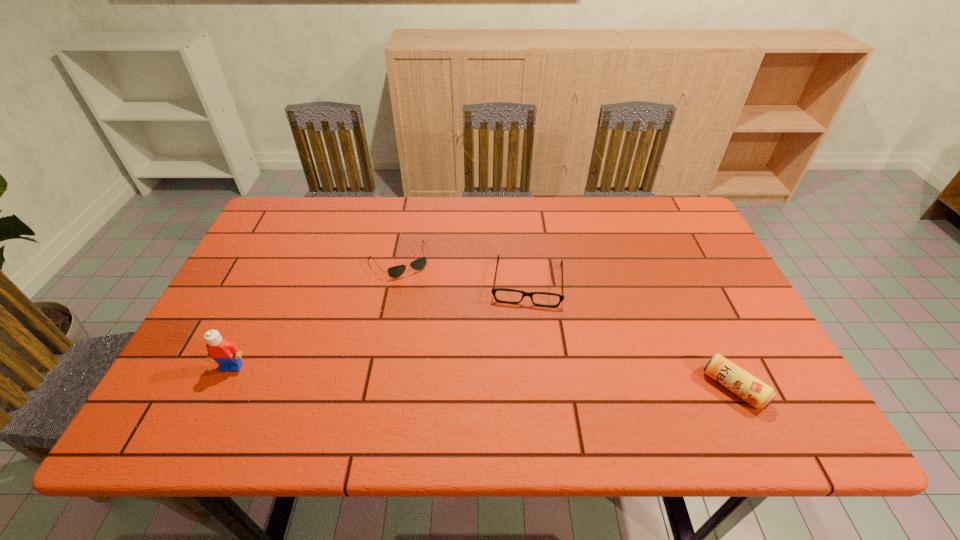
Locate an element on the screen. Image resolution: width=960 pixels, height=540 pixels. the tallest object is located at coordinates (226, 354).

Locate an element on the screen. Image resolution: width=960 pixels, height=540 pixels. Lego is located at coordinates (226, 354).

Where is `the rightmost object`? This screenshot has width=960, height=540. the rightmost object is located at coordinates (746, 386).

Identify the location of the third object from right to left. (396, 271).

The width and height of the screenshot is (960, 540). Identify the location of the third object from left to right. (524, 293).

Locate an element on the screen. The image size is (960, 540). free space located on the left of the rightmost object is located at coordinates (669, 388).

The width and height of the screenshot is (960, 540). Identify the location of free space located 0.330m on the lenses of the second object from left to right. (464, 370).

At what (x,y) coordinates should I click in order to perform the action: click on blank area located on the lenses of the second object from left to right. Please return your answer as a coordinate pair (x, y). Looking at the image, I should click on (451, 348).

In order to click on free space located 0.320m on the lenses of the second object from left to right in this screenshot , I will do `click(462, 367)`.

Find the location of a particular element. Image resolution: width=960 pixels, height=540 pixels. vacant position located on the front-facing side of the spectacles is located at coordinates (521, 364).